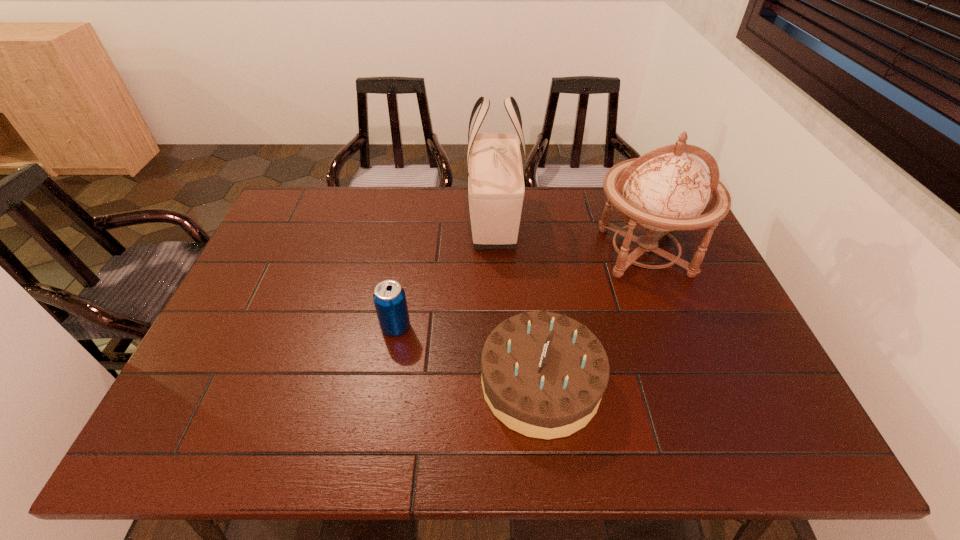
This screenshot has height=540, width=960. What are the coordinates of `shopping bag` in the screenshot? It's located at (496, 188).

Locate an element on the screen. The height and width of the screenshot is (540, 960). globe is located at coordinates (666, 189).

At what (x,y) coordinates should I click in order to perform the action: click on pop soda. Please return your answer as a coordinate pair (x, y). Image resolution: width=960 pixels, height=540 pixels. Looking at the image, I should click on (389, 297).

Find the location of a particular element. birthday cake is located at coordinates 543,374.

This screenshot has width=960, height=540. I want to click on free point located 0.280m with handles facing forward on the shopping bag, so click(x=498, y=329).

Identify the location of free space located 0.270m at the front of the globe showing Africa. (693, 375).

The height and width of the screenshot is (540, 960). What are the coordinates of `vacant space located 0.380m on the right of the leftmost object` in the screenshot? It's located at (558, 327).

This screenshot has width=960, height=540. In order to click on free space located on the front-facing side of the birthday cake in this screenshot , I will do `click(334, 383)`.

Image resolution: width=960 pixels, height=540 pixels. I want to click on free space located on the front-facing side of the birthday cake, so click(343, 383).

Find the location of a particular element. Image resolution: width=960 pixels, height=540 pixels. free region located on the front-facing side of the birthday cake is located at coordinates (347, 383).